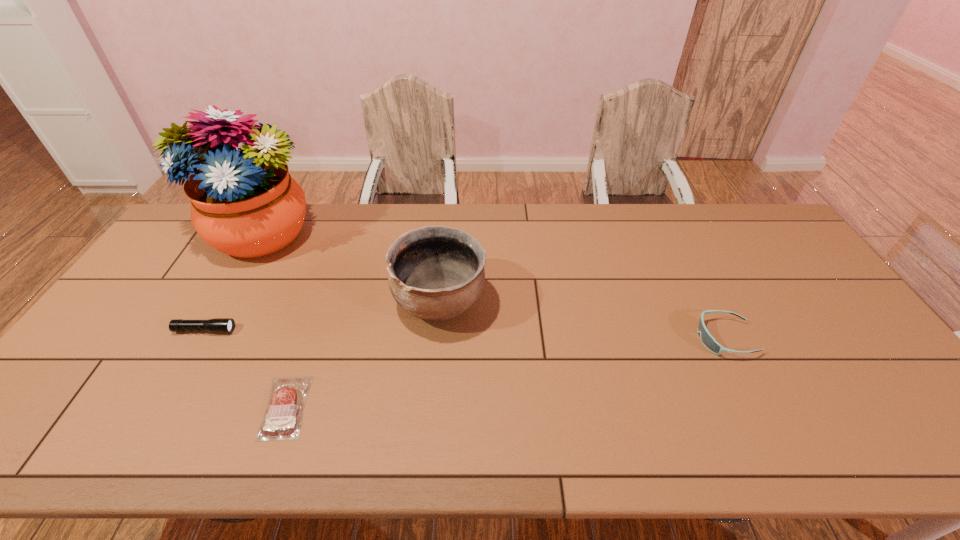
Find the location of `blank space at the near edge of the desktop`. blank space at the near edge of the desktop is located at coordinates tap(221, 445).

The width and height of the screenshot is (960, 540). I want to click on free space at the left edge, so click(x=192, y=253).

Locate an element on the screen. The image size is (960, 540). vacant space at the right edge of the desktop is located at coordinates (902, 403).

The width and height of the screenshot is (960, 540). In order to click on vacant space at the far right corner in this screenshot , I will do `click(742, 216)`.

Image resolution: width=960 pixels, height=540 pixels. I want to click on unoccupied position between the tallest object and the fourth object from left to right, so click(x=348, y=268).

Where is `unoccupied area between the flashlight and the second object from right to left`? Image resolution: width=960 pixels, height=540 pixels. unoccupied area between the flashlight and the second object from right to left is located at coordinates (323, 316).

Where is `vacant space in between the second object from right to left and the shortest object`? vacant space in between the second object from right to left and the shortest object is located at coordinates (363, 354).

At what (x,y) coordinates should I click in order to perform the action: click on free spot between the second shortest object and the goggles. Please return your answer as a coordinate pair (x, y). Looking at the image, I should click on (465, 334).

You are a GUI agent. You are given a task and a screenshot of the screen. Output one action in this format:
    pyautogui.click(x=<x>, y=<y>)
    Task: Click on the vacant space that's between the pottery and the third shortest object
    The image size is (960, 540).
    Given the screenshot: What is the action you would take?
    pyautogui.click(x=582, y=320)

This screenshot has width=960, height=540. I want to click on vacant space that is in between the tallest object and the second shortest object, so click(x=231, y=282).